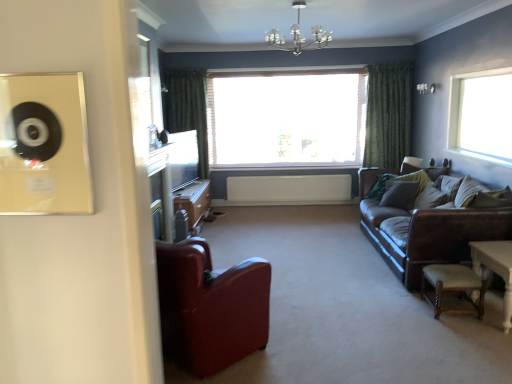
Locate an element on the screen. blank space situated above beige woven stool at lower right (from a real-world perspective) is located at coordinates (454, 278).